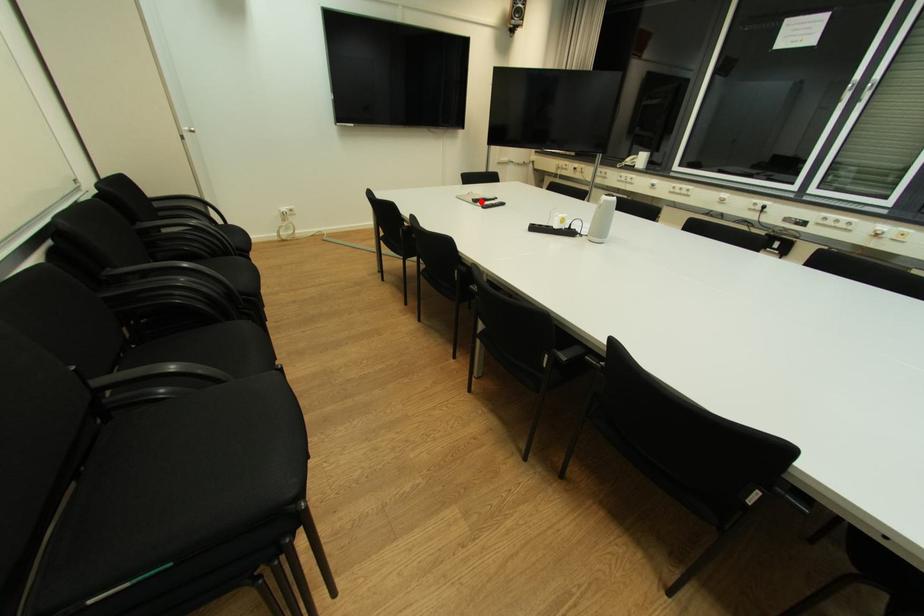
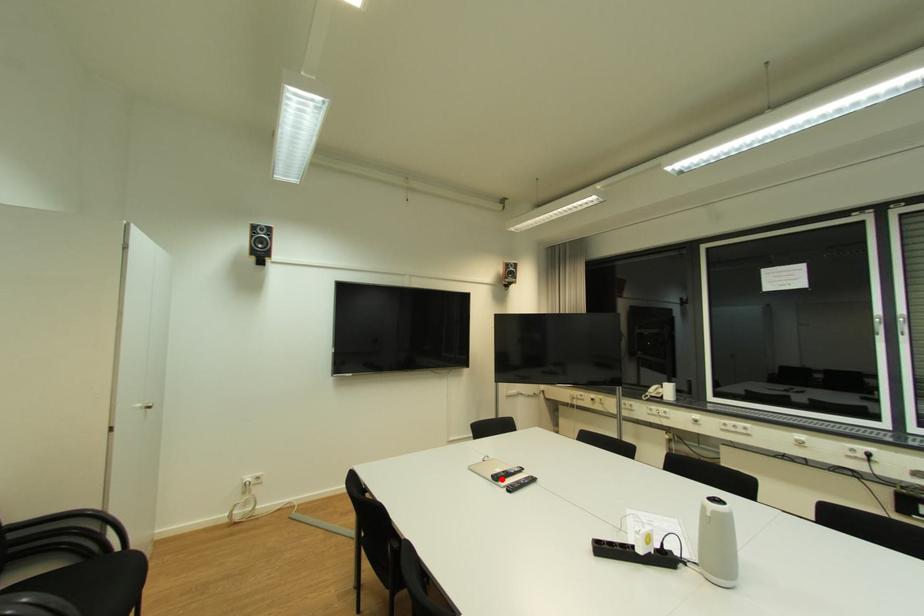
I am providing you with two images of the same scene from different viewpoints. A red point is marked on the first image and another point is marked on the second image. Does the point marked in image1 correspond to the same location as the one in image2?

Yes